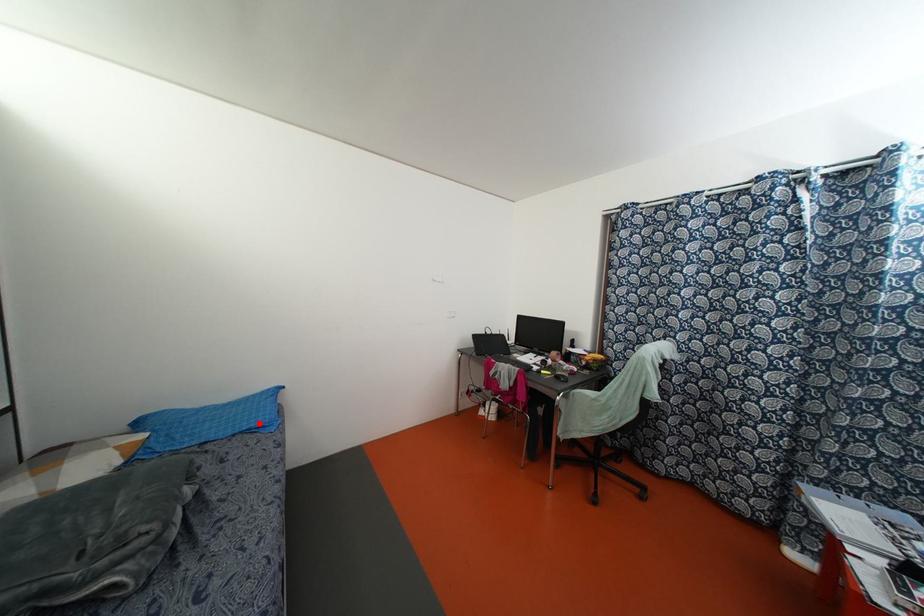
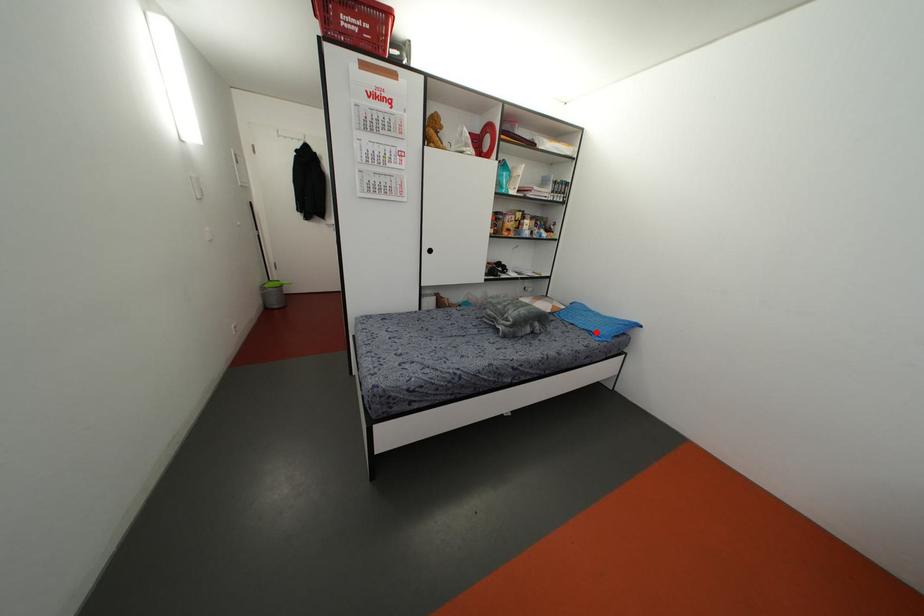
I am providing you with two images of the same scene from different viewpoints. A red point is marked on the first image and another point is marked on the second image. Do the highlighted points in image1 and image2 indicate the same real-world spot?

Yes